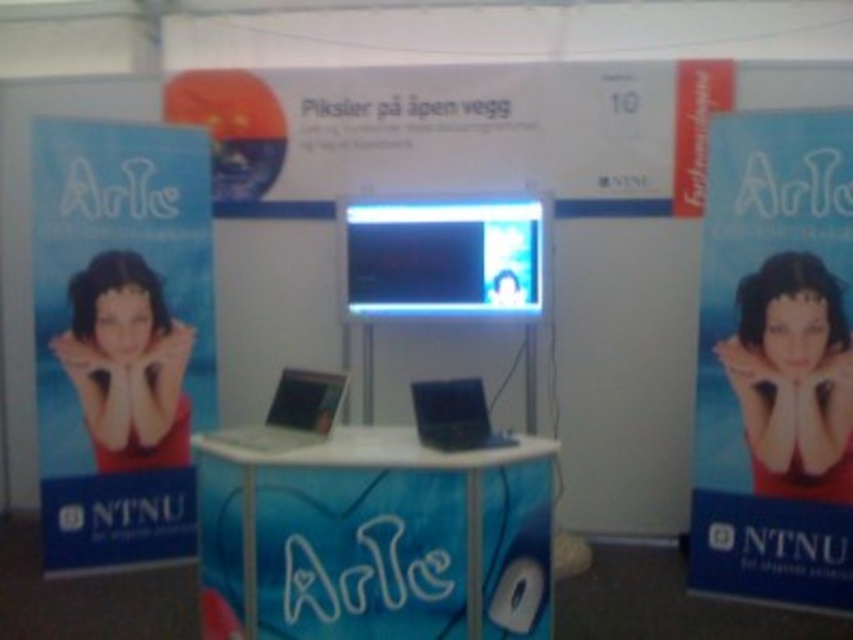
Question: Is the position of blue glossy poster at center less distant than that of matte black laptop at center?

Choices:
 (A) no
 (B) yes

Answer: (A)

Question: Which object is the closest to the blue glossy poster at center?

Choices:
 (A) blue paper poster at left
 (B) matte red poster at center

Answer: (B)

Question: Is matte red poster at center to the right of shiny blue laptop at center from the viewer's perspective?

Choices:
 (A) no
 (B) yes

Answer: (B)

Question: Does blue glossy poster at center appear on the left side of matte red poster at center?

Choices:
 (A) no
 (B) yes

Answer: (B)

Question: Which object appears closest to the camera in this image?

Choices:
 (A) shiny blue laptop at center
 (B) blue glossy poster at center

Answer: (A)

Question: Which object appears closest to the camera in this image?

Choices:
 (A) blue glossy poster at center
 (B) blue paper poster at left
 (C) matte black laptop at center

Answer: (C)